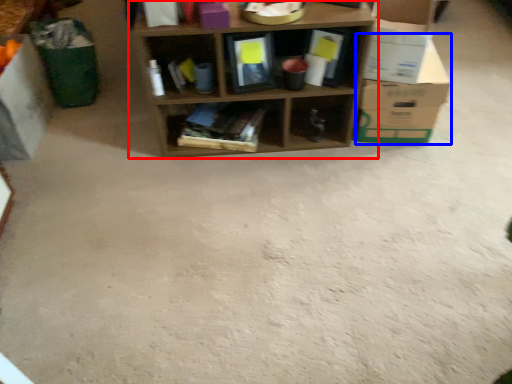
Question: Which point is closer to the camera, shelf (highlighted by a red box) or cardboard box (highlighted by a blue box)?

Choices:
 (A) shelf
 (B) cardboard box

Answer: (A)